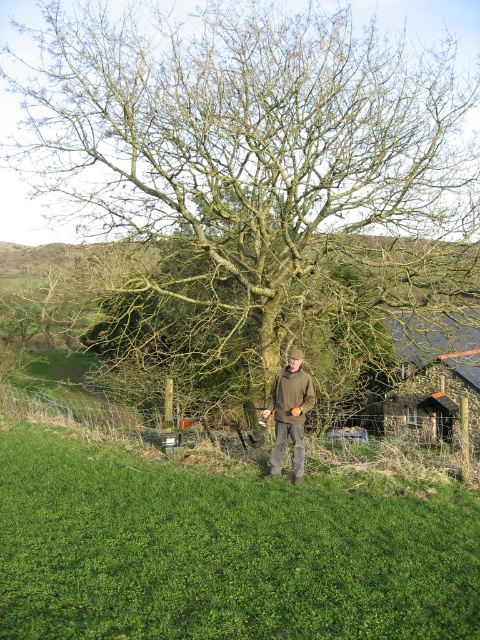
Is green rough bark tree at center in front of stone slate roof hut at right?

No.

Can you confirm if green rough bark tree at center is wider than stone slate roof hut at right?

Indeed, green rough bark tree at center has a greater width compared to stone slate roof hut at right.

Find the location of a particular element. The image size is (480, 640). green rough bark tree at center is located at coordinates (254, 157).

Does green grassy at center have a greater height compared to brown woolen jacket at center?

In fact, green grassy at center may be shorter than brown woolen jacket at center.

Can you confirm if green grassy at center is wider than brown woolen jacket at center?

Correct, the width of green grassy at center exceeds that of brown woolen jacket at center.

Does point (410, 557) come in front of point (288, 429)?

Yes.

Image resolution: width=480 pixels, height=640 pixels. I want to click on green grassy at center, so click(222, 548).

At what (x,y) coordinates should I click in order to perform the action: click on green rough bark tree at center. Please return your answer as a coordinate pair (x, y). Image resolution: width=480 pixels, height=640 pixels. Looking at the image, I should click on (254, 157).

Who is more forward, (313,291) or (277,426)?

Positioned in front is point (277,426).

This screenshot has width=480, height=640. I want to click on green rough bark tree at center, so click(254, 157).